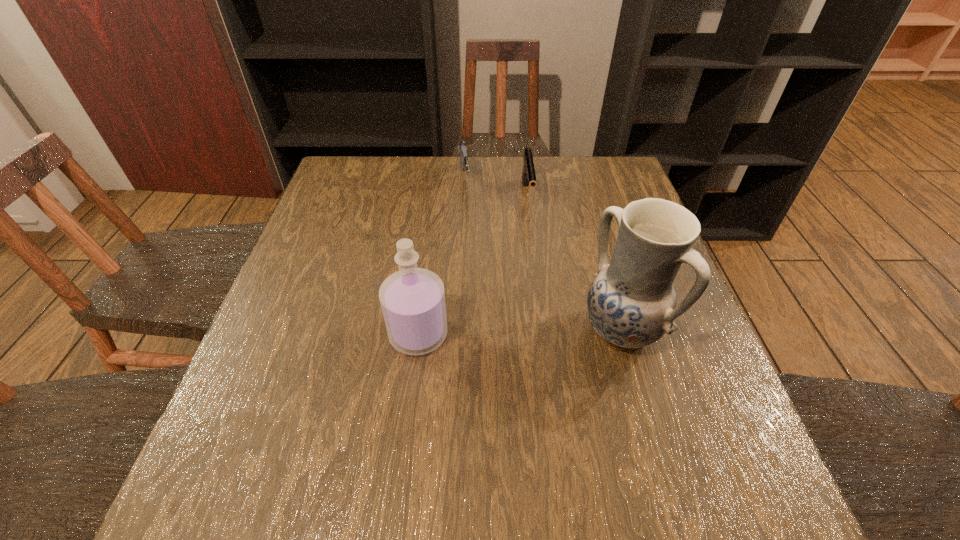
This screenshot has height=540, width=960. What are the coordinates of `the second tallest object` in the screenshot? It's located at (412, 299).

Where is `pottery`? This screenshot has height=540, width=960. pottery is located at coordinates (631, 303).

Where is `pistol`? pistol is located at coordinates (528, 173).

The height and width of the screenshot is (540, 960). What are the coordinates of `gun` in the screenshot? It's located at (462, 147).

At what (x,y) coordinates should I click in order to perform the action: click on vacant space located 0.260m on the right of the third shortest object. Please return your answer as a coordinate pair (x, y). This screenshot has width=960, height=540. Looking at the image, I should click on (572, 334).

In order to click on vacant space located 0.120m on the front of the rightmost object in this screenshot , I will do `click(647, 423)`.

Where is `free space located at the muzzle of the pistol`? This screenshot has height=540, width=960. free space located at the muzzle of the pistol is located at coordinates (540, 291).

Identify the location of free space located at the muzzle of the pistol. This screenshot has width=960, height=540. (534, 240).

Locate an element on the screen. vacant point located at the muzzle of the pistol is located at coordinates (545, 329).

Find the location of a particular element. free location located 0.360m at the barrel of the gun is located at coordinates (481, 299).